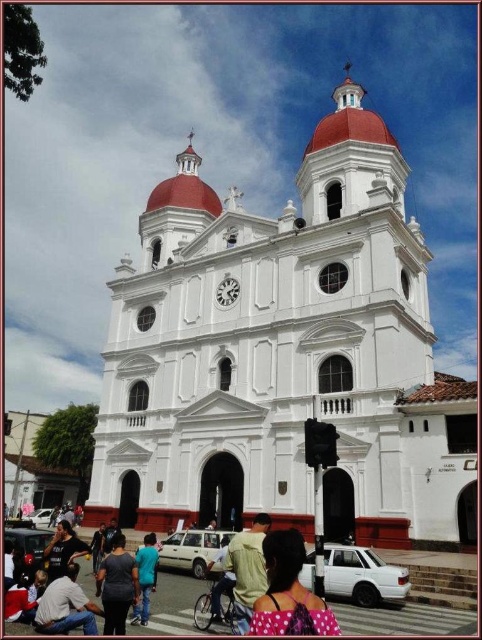
Question: Can you confirm if polka dot fabric at lower center is positioned to the left of light green fabric shirt at center?

Choices:
 (A) no
 (B) yes

Answer: (A)

Question: Where is polka dot fabric at lower center located in relation to blue cotton shirt at center in the image?

Choices:
 (A) above
 (B) below

Answer: (A)

Question: Which point is farther from the camera taking this photo?

Choices:
 (A) (40, 611)
 (B) (145, 596)
 (C) (240, 540)

Answer: (B)

Question: Among these points, which one is nearest to the camera?

Choices:
 (A) (77, 618)
 (B) (311, 604)

Answer: (B)

Question: Can you confirm if white smooth church at center is wider than dark blue shirt at lower left?

Choices:
 (A) no
 (B) yes

Answer: (B)

Question: Which is nearer to the white smooth church at center?

Choices:
 (A) dark gray fabric shirt at lower left
 (B) blue cotton shirt at center
 (C) matte black shirt at lower left
 (D) dark blue shirt at lower left

Answer: (D)